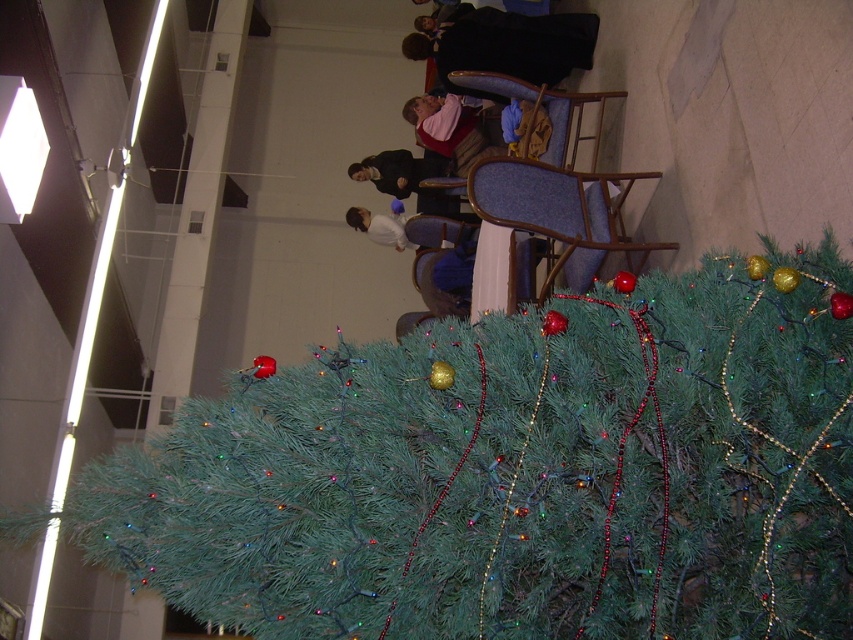
You are at a holiday party and see the green artificial christmas tree at center and the pink fabric shirt at upper center. Which object is located to the right of the other?

The green artificial christmas tree at center is positioned on the right side of pink fabric shirt at upper center.

You are a delivery person trying to place a large package in the room. The package is 3 meters long. You want to place it between the green artificial christmas tree at center and the white matte shirt at upper center. Is there enough space between them to fit the package?

The distance between the green artificial christmas tree at center and the white matte shirt at upper center is 5.26 meters. Since the package is 3 meters long, there is enough space to fit it between them.